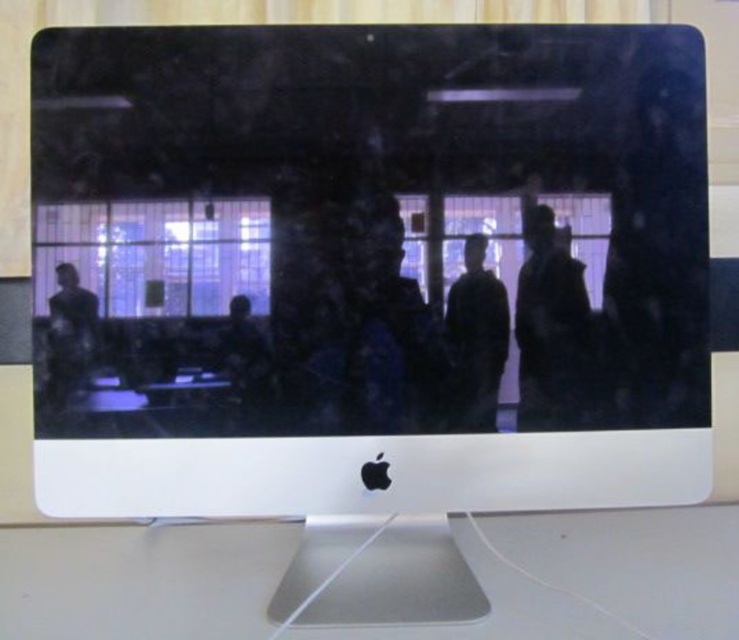
Identify the location of dark fabric jacket at right. (551, 326).

Can you confirm if dark fabric jacket at right is positioned to the left of black matte jacket at center?

No, dark fabric jacket at right is not to the left of black matte jacket at center.

What do you see at coordinates (551, 326) in the screenshot? This screenshot has height=640, width=739. I see `dark fabric jacket at right` at bounding box center [551, 326].

Where is `dark fabric jacket at right`? Image resolution: width=739 pixels, height=640 pixels. dark fabric jacket at right is located at coordinates (551, 326).

Can you confirm if black matte jacket at center is shorter than matte black jacket at left?

No, black matte jacket at center is not shorter than matte black jacket at left.

The height and width of the screenshot is (640, 739). What do you see at coordinates (474, 340) in the screenshot? I see `black matte jacket at center` at bounding box center [474, 340].

This screenshot has height=640, width=739. Find the location of `black matte jacket at center`. black matte jacket at center is located at coordinates (474, 340).

Between silver metallic computer desk at center and matte black jacket at left, which one is positioned lower?

silver metallic computer desk at center

Who is positioned more to the right, silver metallic computer desk at center or matte black jacket at left?

silver metallic computer desk at center

This screenshot has height=640, width=739. I want to click on silver metallic computer desk at center, so click(x=140, y=580).